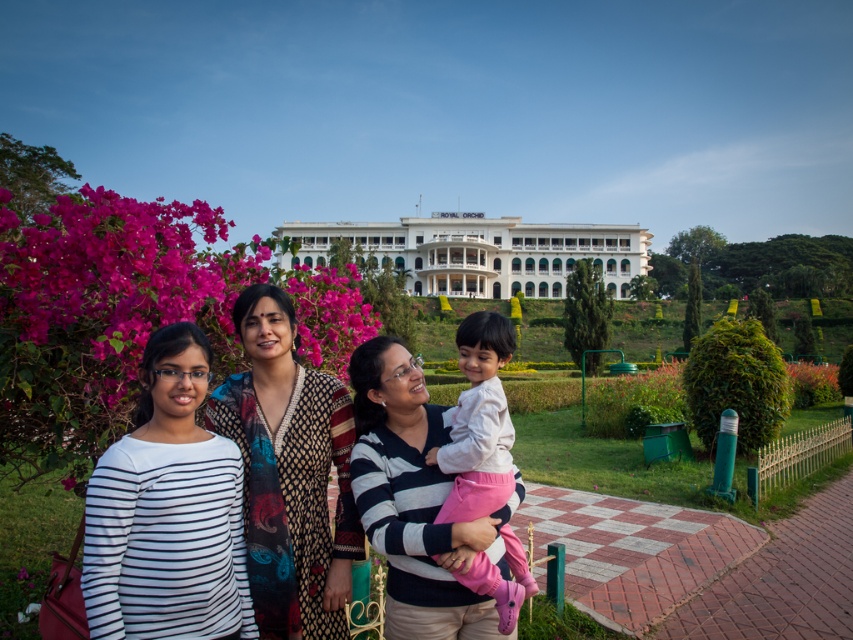
The height and width of the screenshot is (640, 853). I want to click on striped cotton shirt at center, so click(x=289, y=470).

Who is positioned more to the left, striped cotton shirt at center or white glossy building at center?

striped cotton shirt at center

Is point (334, 442) positioned before point (554, 234)?

Yes.

The height and width of the screenshot is (640, 853). Identify the location of striped cotton shirt at center. (289, 470).

Is white glossy building at center bigger than light pink fabric at center?

Correct, white glossy building at center is larger in size than light pink fabric at center.

Consider the image. Does white glossy building at center appear on the right side of light pink fabric at center?

Correct, you'll find white glossy building at center to the right of light pink fabric at center.

Measure the distance between point (410, 228) and camera.

The distance of point (410, 228) from camera is 150.15 meters.

The image size is (853, 640). Find the location of `white glossy building at center`. white glossy building at center is located at coordinates click(480, 252).

Who is more distant from viewer, (292, 285) or (347, 522)?

Positioned behind is point (292, 285).

Does purple matte flowers at upper left appear on the right side of striped cotton shirt at center?

Incorrect, purple matte flowers at upper left is not on the right side of striped cotton shirt at center.

This screenshot has width=853, height=640. Find the location of `purple matte flowers at upper left`. purple matte flowers at upper left is located at coordinates (144, 292).